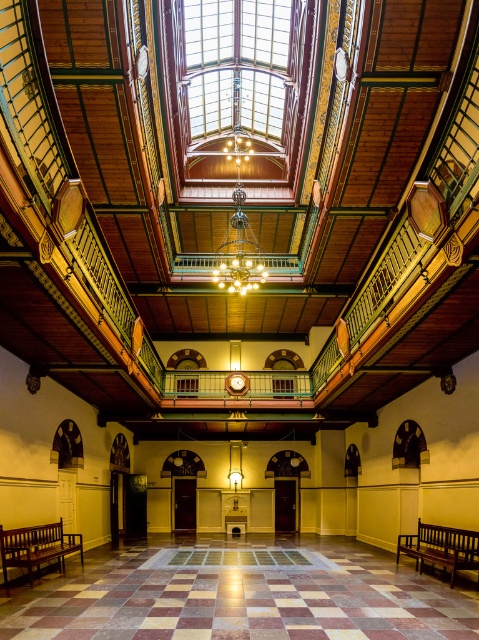
Which is in front, point (367, 593) or point (12, 541)?

Point (367, 593) is in front.

Where is `marble tile floor at center`? The width and height of the screenshot is (479, 640). marble tile floor at center is located at coordinates (239, 595).

Find the location of a particular element. marble tile floor at center is located at coordinates (239, 595).

In the scene shown: Does dark brown wooden bench at lower right have a lesser width compared to wooden bench at lower left?

Incorrect, dark brown wooden bench at lower right's width is not less than wooden bench at lower left's.

Does dark brown wooden bench at lower right have a larger size compared to wooden bench at lower left?

Actually, dark brown wooden bench at lower right might be smaller than wooden bench at lower left.

Between point (454, 566) and point (11, 548), which one is positioned behind?

Positioned behind is point (11, 548).

In order to click on dark brown wooden bench at lower right in this screenshot , I will do `click(441, 547)`.

Does marble tile floor at center appear over dark brown wooden bench at lower right?

No.

Who is lower down, marble tile floor at center or dark brown wooden bench at lower right?

marble tile floor at center is lower down.

Who is more distant from viewer, (410, 600) or (425, 548)?

The point (425, 548) is more distant.

The height and width of the screenshot is (640, 479). In order to click on marble tile floor at center in this screenshot , I will do `click(239, 595)`.